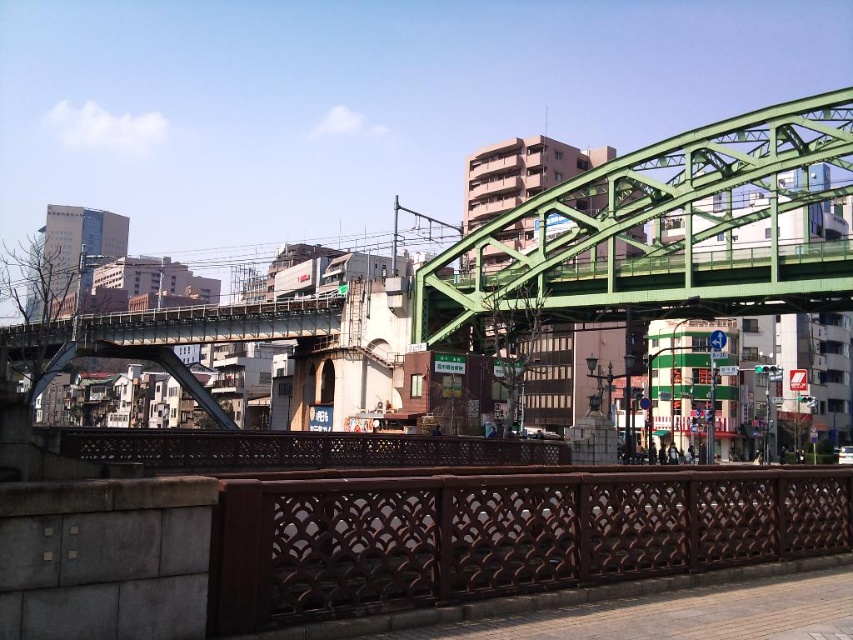
You are standing at the camera position looking at the scene. There are two points marked in the image, one at coordinates point (653, 522) and the other at point (814, 228). Which of these two points is closer to you?

Point (653, 522) is closer to the camera than point (814, 228).

You are a delivery drone with a wingspan of 1.5 meters. You need to fly from the brown textured rail at lower center to the brown wooden rail at center. Can you safely navigate the space between them without hitting either rail?

The distance between the brown textured rail at lower center and brown wooden rail at center is 24.90 meters. Since your wingspan is only 1.5 meters, there is ample space to safely navigate between them without any collision risk.

You are a pedestrian standing on the brown textured rail at lower center and want to cross to the green metallic bridge at upper center. Which direction should you walk to reach the bridge?

The brown textured rail at lower center is positioned on the left side of the green metallic bridge at upper center, so you should walk to the right to reach the bridge.